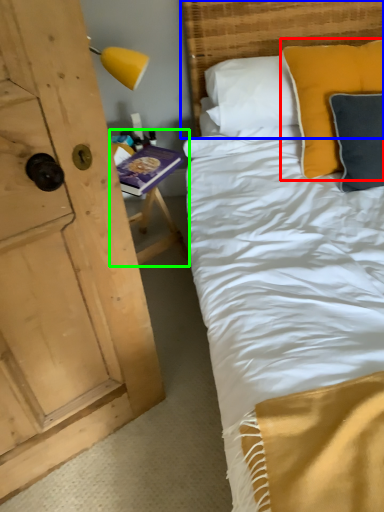
Question: Estimate the real-world distances between objects in this image. Which object is closer to pillow (highlighted by a red box), headboard (highlighted by a blue box) or table (highlighted by a green box)?

Choices:
 (A) headboard
 (B) table

Answer: (A)